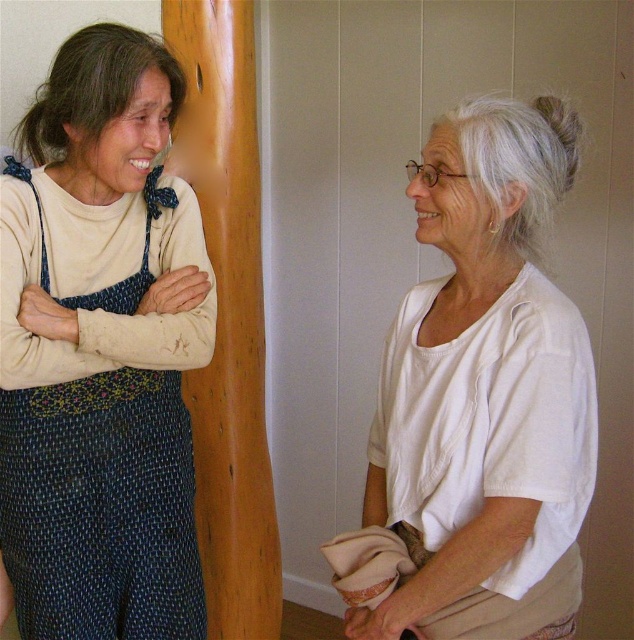
Question: Is blue woven apron at left in front of white cotton sleeve at upper left?

Choices:
 (A) no
 (B) yes

Answer: (A)

Question: Which object is the farthest from the blue woven apron at left?

Choices:
 (A) white cotton sleeve at upper left
 (B) white cotton shirt at right

Answer: (B)

Question: Which object appears closest to the camera in this image?

Choices:
 (A) white cotton shirt at right
 (B) white cotton sleeve at upper left
 (C) blue woven apron at left

Answer: (A)

Question: Can you confirm if white cotton shirt at right is positioned to the left of white cotton sleeve at upper left?

Choices:
 (A) yes
 (B) no

Answer: (B)

Question: Does blue woven apron at left appear under white cotton sleeve at upper left?

Choices:
 (A) no
 (B) yes

Answer: (B)

Question: Among these points, which one is nearest to the camera?

Choices:
 (A) (195, 625)
 (B) (79, 266)
 (C) (469, 444)

Answer: (C)